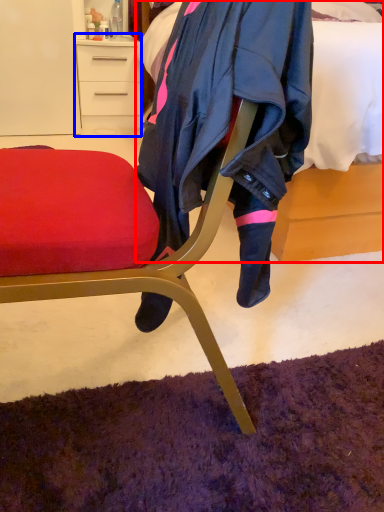
Question: Among these objects, which one is nearest to the camera, bed (highlighted by a red box) or desk (highlighted by a blue box)?

Choices:
 (A) bed
 (B) desk

Answer: (A)